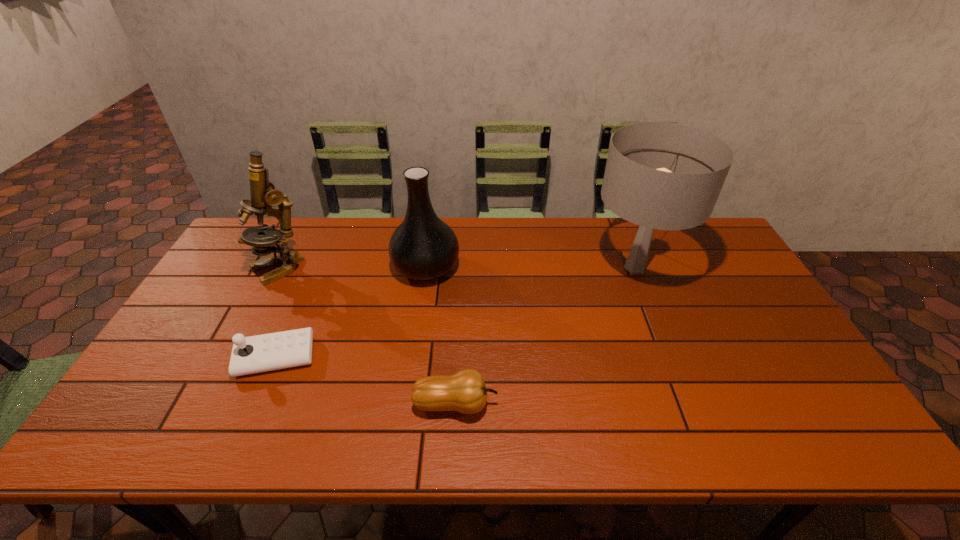
Where is `vacant space at the left edge`? The height and width of the screenshot is (540, 960). vacant space at the left edge is located at coordinates (166, 374).

Where is `vacant space at the right edge of the desktop`? The height and width of the screenshot is (540, 960). vacant space at the right edge of the desktop is located at coordinates (710, 290).

The height and width of the screenshot is (540, 960). I want to click on vacant region at the far left corner of the desktop, so click(233, 253).

Where is `vacant space that's between the joystick and the vase`? vacant space that's between the joystick and the vase is located at coordinates (350, 312).

Image resolution: width=960 pixels, height=540 pixels. Identify the location of free spot between the nearest object and the rightmost object. (545, 335).

Find the location of `unoccupied area between the joystick and the rightmost object`. unoccupied area between the joystick and the rightmost object is located at coordinates (455, 312).

What are the coordinates of `unoccupied position between the lampshade and the vase` in the screenshot? It's located at (530, 267).

Where is `empty space that is in between the microscope and the nearest object`? The width and height of the screenshot is (960, 540). empty space that is in between the microscope and the nearest object is located at coordinates (367, 336).

At what (x,y) coordinates should I click in order to perform the action: click on free spot between the nearest object and the joystick. Please return your answer as a coordinate pair (x, y). This screenshot has height=540, width=960. Looking at the image, I should click on (366, 381).

The height and width of the screenshot is (540, 960). In order to click on free spot between the microscope and the second nearest object in this screenshot , I will do `click(276, 313)`.